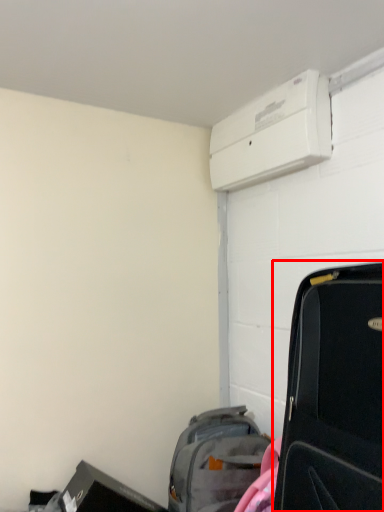
Question: Observing the image, what is the correct spatial positioning of suitcase (annotated by the red box) in reference to luggage and bags?

Choices:
 (A) right
 (B) left

Answer: (A)